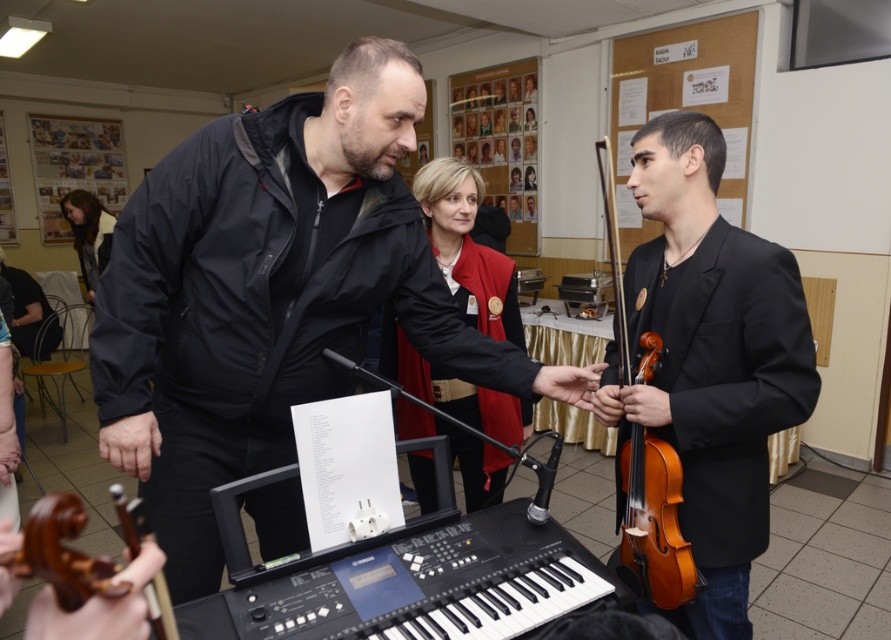
Which is more to the left, black plastic keyboard at center or blonde hair at upper left?

From the viewer's perspective, blonde hair at upper left appears more on the left side.

Can you confirm if black plastic keyboard at center is positioned to the right of blonde hair at upper left?

Yes, black plastic keyboard at center is to the right of blonde hair at upper left.

Identify the location of black plastic keyboard at center. (421, 586).

Find the location of `black plastic keyboard at center`. black plastic keyboard at center is located at coordinates (421, 586).

Is point (783, 300) positioned behind point (29, 547)?

Yes, point (783, 300) is behind point (29, 547).

This screenshot has width=891, height=640. Describe the element at coordinates (710, 358) in the screenshot. I see `shiny brown violin at right` at that location.

Find the location of a particular element. The width and height of the screenshot is (891, 640). shiny brown violin at right is located at coordinates (710, 358).

Is wooden violin at right above blonde hair at upper left?

Incorrect, wooden violin at right is not positioned above blonde hair at upper left.

Who is positioned more to the right, wooden violin at right or blonde hair at upper left?

Positioned to the right is wooden violin at right.

Who is more forward, (635, 580) or (80, 228)?

Point (635, 580) is more forward.

The height and width of the screenshot is (640, 891). Identify the location of wooden violin at right. (654, 524).